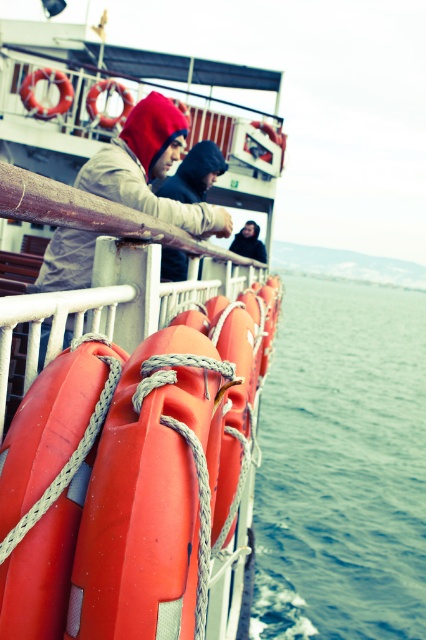
Can you confirm if blue water at lower right is positioned below matte beige hoodie at center?

No.

Which is above, blue water at lower right or matte beige hoodie at center?

blue water at lower right

What do you see at coordinates (342, 467) in the screenshot? I see `blue water at lower right` at bounding box center [342, 467].

Where is `blue water at lower right`? This screenshot has width=426, height=640. blue water at lower right is located at coordinates (342, 467).

Is point (78, 252) more distant than point (215, 154)?

No.

Is matte beige hoodie at center closer to camera compared to matte gray hoodie at upper left?

Yes, matte beige hoodie at center is closer to the viewer.

This screenshot has width=426, height=640. Identify the location of matte beige hoodie at center. (149, 168).

I want to click on matte beige hoodie at center, so click(149, 168).

Is rubber lifebuoys at center taller than dark gray hoodie at center?

Yes.

Is rubber lifebuoys at center bigger than dark gray hoodie at center?

Yes, rubber lifebuoys at center is bigger than dark gray hoodie at center.

Where is `rubber lifebuoys at center`? The width and height of the screenshot is (426, 640). rubber lifebuoys at center is located at coordinates (127, 348).

Where is `rubber lifebuoys at center`? This screenshot has width=426, height=640. rubber lifebuoys at center is located at coordinates (127, 348).